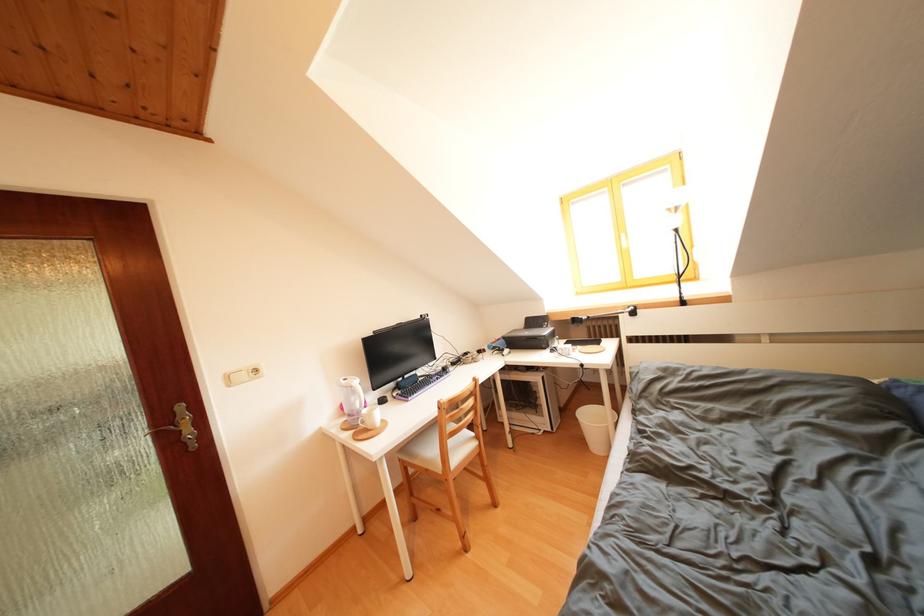
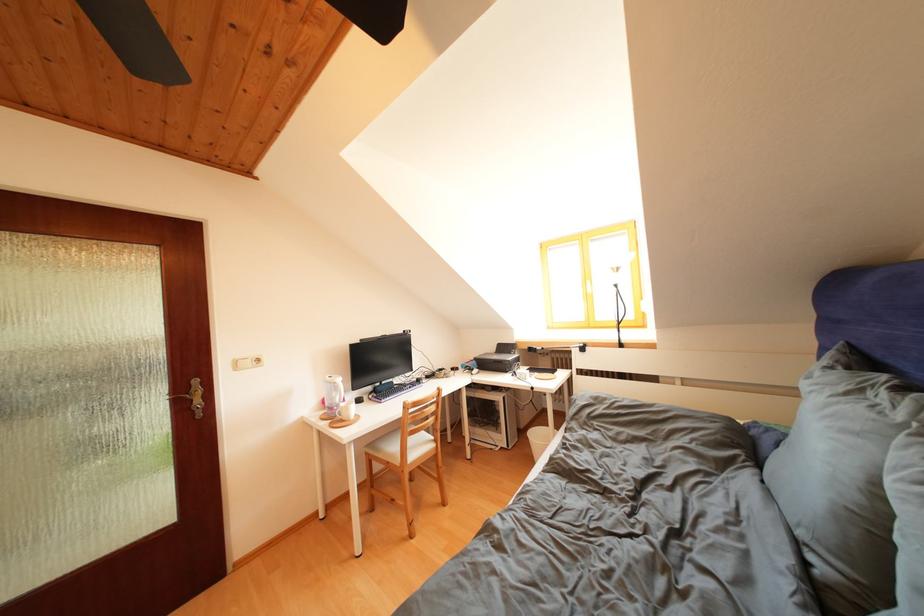
In the second image, find the point that corresponds to (237,384) in the first image.

(244, 369)